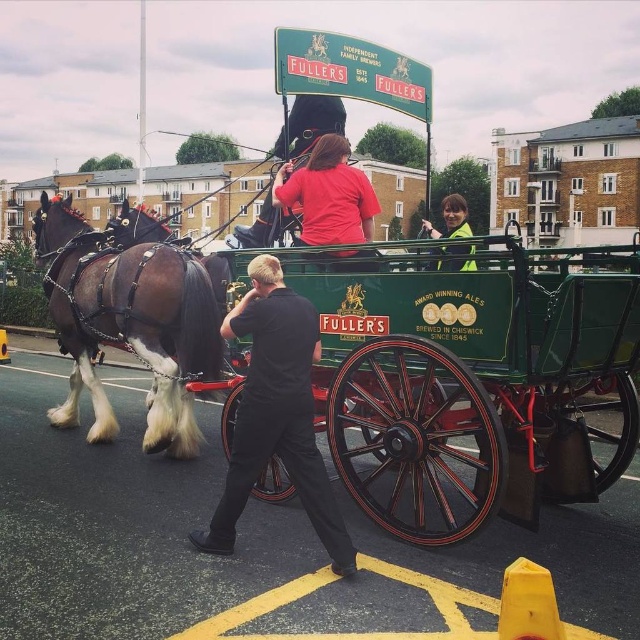
Question: Can you confirm if green polished wood wagon at center is positioned above black cotton shirt at center?

Choices:
 (A) no
 (B) yes

Answer: (B)

Question: Which object is farther from the camera taking this photo?

Choices:
 (A) reflective yellow vest at upper right
 (B) brown glossy horse at left

Answer: (B)

Question: Among these points, which one is farthest from the camera?

Choices:
 (A) (228, 552)
 (B) (156, 444)
 (C) (404, 536)
 (D) (449, 205)

Answer: (D)

Question: Does black cotton shirt at center appear on the left side of reflective yellow vest at upper right?

Choices:
 (A) yes
 (B) no

Answer: (A)

Question: Is brown glossy horse at left below matte red shirt at center?

Choices:
 (A) no
 (B) yes

Answer: (B)

Question: Among these points, which one is farthest from the camera?

Choices:
 (A) (106, 328)
 (B) (259, 360)
 (C) (365, 360)
 (D) (449, 260)

Answer: (A)